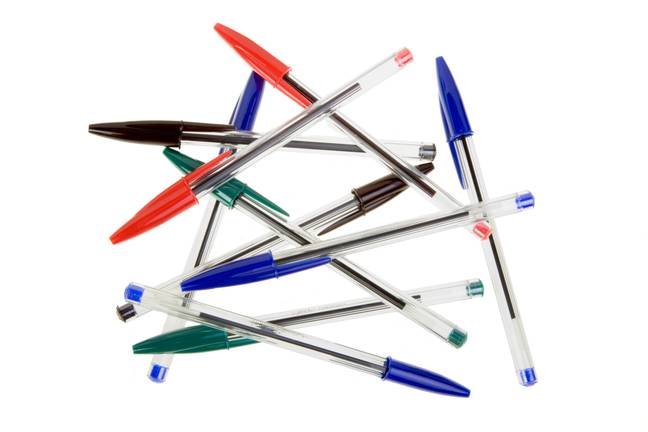
Locate an element on the screen. The image size is (648, 432). pens is located at coordinates (356, 131), (350, 89), (314, 140), (339, 205), (275, 220), (305, 313), (295, 340), (499, 263), (362, 239), (205, 230).